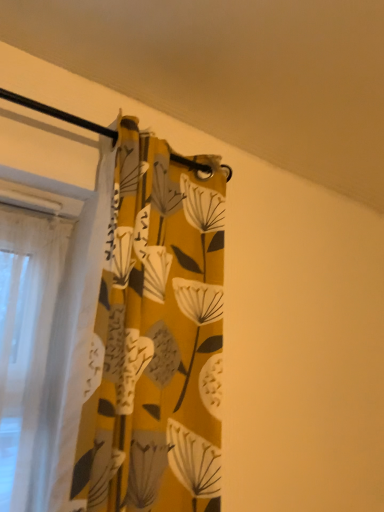
Measure the distance between yellow fabric at upper left and camera.

yellow fabric at upper left and camera are 83.30 centimeters apart from each other.

I want to click on yellow fabric at upper left, so click(236, 73).

Image resolution: width=384 pixels, height=512 pixels. Describe the element at coordinates (236, 73) in the screenshot. I see `yellow fabric at upper left` at that location.

Measure the distance between yellow fabric curtain at left and camera.

They are 30.05 inches apart.

Describe the element at coordinates (146, 336) in the screenshot. This screenshot has height=512, width=384. I see `yellow fabric curtain at left` at that location.

You are a GUI agent. You are given a task and a screenshot of the screen. Output one action in this format:
    pyautogui.click(x=<x>, y=<y>)
    Task: Click on the yellow fabric curtain at left
    The height and width of the screenshot is (512, 384).
    Given the screenshot: What is the action you would take?
    pyautogui.click(x=146, y=336)

The height and width of the screenshot is (512, 384). Find the location of `yellow fabric at upper left`. yellow fabric at upper left is located at coordinates (236, 73).

Looking at this image, which is more to the left, yellow fabric curtain at left or yellow fabric at upper left?

yellow fabric curtain at left is more to the left.

Which object is closer to the camera, yellow fabric curtain at left or yellow fabric at upper left?

Positioned in front is yellow fabric at upper left.

Which is less distant, [214,483] or [50,13]?

Point [50,13]

From the image's perspective, which is above, yellow fabric curtain at left or yellow fabric at upper left?

From the image's view, yellow fabric at upper left is above.

From a real-world perspective, is yellow fabric curtain at left positioned above or below yellow fabric at upper left?

In terms of real-world spatial position, yellow fabric curtain at left is below yellow fabric at upper left.

Which of these two, yellow fabric curtain at left or yellow fabric at upper left, is thinner?

yellow fabric curtain at left.

Between yellow fabric curtain at left and yellow fabric at upper left, which one has less height?

yellow fabric at upper left is shorter.

Does yellow fabric curtain at left have a smaller size compared to yellow fabric at upper left?

Yes.

Would you say yellow fabric curtain at left contains yellow fabric at upper left?

No, yellow fabric at upper left is not a part of yellow fabric curtain at left.

Is yellow fabric curtain at left far from yellow fabric at upper left?

No, yellow fabric curtain at left is in close proximity to yellow fabric at upper left.

Could you tell me if yellow fabric curtain at left is turned towards yellow fabric at upper left?

No, yellow fabric curtain at left is not facing towards yellow fabric at upper left.

This screenshot has width=384, height=512. In order to click on backdrop located on the right of yellow fabric curtain at left in this screenshot , I will do `click(236, 73)`.

From the picture: Is yellow fabric at upper left to the left or to the right of yellow fabric curtain at left in the image?

From the image, it's evident that yellow fabric at upper left is to the right of yellow fabric curtain at left.

Does yellow fabric at upper left come in front of yellow fabric curtain at left?

Yes, it is.

Is point (198, 123) positioned before point (110, 387)?

No, it is not.

From the image's perspective, which is below, yellow fabric at upper left or yellow fabric curtain at left?

From the image's view, yellow fabric curtain at left is below.

From a real-world perspective, does yellow fabric at upper left sit lower than yellow fabric curtain at left?

Incorrect, from a real-world perspective, yellow fabric at upper left is higher than yellow fabric curtain at left.

Considering the relative sizes of yellow fabric at upper left and yellow fabric curtain at left in the image provided, is yellow fabric at upper left wider than yellow fabric curtain at left?

Yes, yellow fabric at upper left is wider than yellow fabric curtain at left.

Considering the sizes of yellow fabric at upper left and yellow fabric curtain at left in the image, is yellow fabric at upper left taller or shorter than yellow fabric curtain at left?

In the image, yellow fabric at upper left appears to be shorter than yellow fabric curtain at left.

Can you confirm if yellow fabric at upper left is smaller than yellow fabric curtain at left?

Actually, yellow fabric at upper left might be larger than yellow fabric curtain at left.

Could yellow fabric curtain at left be considered to be inside yellow fabric at upper left?

No, yellow fabric curtain at left is not a part of yellow fabric at upper left.

Is yellow fabric at upper left far away from yellow fabric curtain at left?

No, there isn't a large distance between yellow fabric at upper left and yellow fabric curtain at left.

Is yellow fabric at upper left turned away from yellow fabric curtain at left?

No, yellow fabric at upper left is not facing the opposite direction of yellow fabric curtain at left.

Measure the distance from yellow fabric at upper left to yellow fabric curtain at left.

yellow fabric at upper left is 19.05 inches away from yellow fabric curtain at left.

Where is `curtain that is on the left side of yellow fabric at upper left`? The width and height of the screenshot is (384, 512). curtain that is on the left side of yellow fabric at upper left is located at coordinates (146, 336).

Image resolution: width=384 pixels, height=512 pixels. Identify the location of backdrop above the yellow fabric curtain at left (from the image's perspective). (236, 73).

Locate an element on the screen. curtain located below the yellow fabric at upper left (from the image's perspective) is located at coordinates click(x=146, y=336).